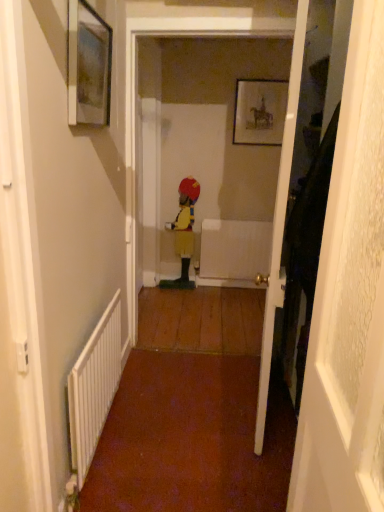
Question: From the image's perspective, relative to matte glass picture frame at upper left, marked as the first picture frame in a bottom-to-top arrangement, is matte black picture frame at upper center, the 1th picture frame in the top-to-bottom sequence, above or below?

Choices:
 (A) above
 (B) below

Answer: (A)

Question: Is matte black picture frame at upper center, the second picture frame from the left, wider or thinner than matte glass picture frame at upper left, the first picture frame in the front-to-back sequence?

Choices:
 (A) wide
 (B) thin

Answer: (B)

Question: Which object is positioned farthest from the wooden door at right, which is the 2th door in back-to-front order?

Choices:
 (A) matte glass picture frame at upper left, which ranks as the 2th picture frame in right-to-left order
 (B) yellow fabric figure at center
 (C) wooden door at right, which is the second door from front to back
 (D) white metallic radiator at lower left
 (E) matte black picture frame at upper center, the 1th picture frame when ordered from right to left

Answer: (B)

Question: Estimate the real-world distances between objects in this image. Which object is farther from the matte black picture frame at upper center, the 1th picture frame in the top-to-bottom sequence?

Choices:
 (A) wooden door at right, the first door positioned from the back
 (B) white metallic radiator at lower left
 (C) wooden door at right, which is the 2th door in back-to-front order
 (D) yellow fabric figure at center
 (E) matte glass picture frame at upper left, marked as the second picture frame in a top-to-bottom arrangement

Answer: (C)